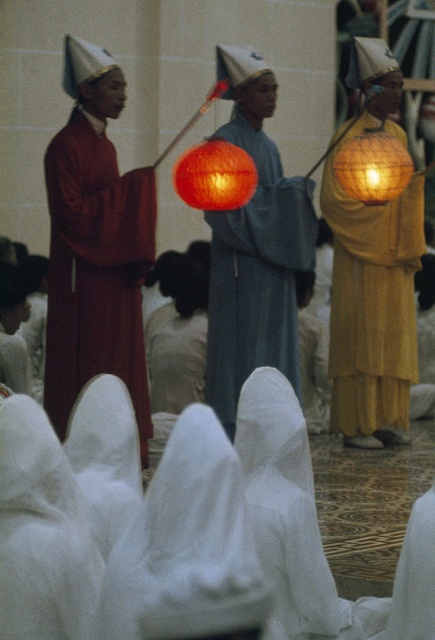
Is point (130, 304) closer to camera compared to point (208, 161)?

No, it is behind (208, 161).

Is matte red robe at left shorter than orange mesh lantern at center?

No.

Identify the location of matte red robe at left. This screenshot has width=435, height=640. (96, 269).

I want to click on matte red robe at left, so click(96, 269).

Does matte red robe at left have a larger size compared to matte gray robe at center?

No.

Does point (73, 140) come farther from viewer compared to point (247, 333)?

No, (73, 140) is in front of (247, 333).

Image resolution: width=435 pixels, height=640 pixels. I want to click on matte red robe at left, so click(96, 269).

Is matte red robe at left taller than bright orange paper lantern at center?

Yes.

How much distance is there between matte red robe at left and bright orange paper lantern at center?

matte red robe at left is 8.38 feet away from bright orange paper lantern at center.

Who is more forward, [104,212] or [375,196]?

Point [104,212] is more forward.

This screenshot has width=435, height=640. In order to click on matte red robe at left in this screenshot , I will do `click(96, 269)`.